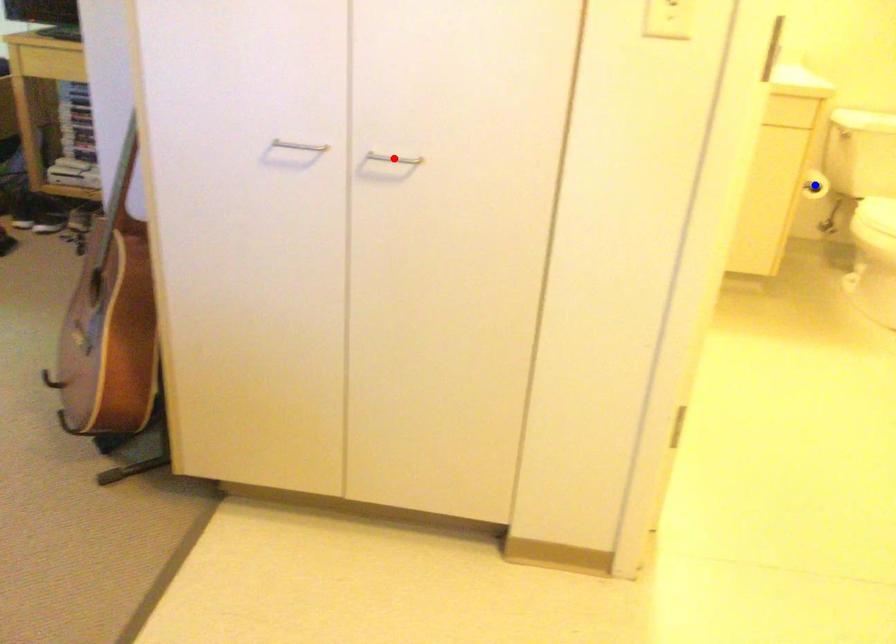
Question: Two points are marked on the image. Which point is closer to the camera?

Choices:
 (A) Blue point is closer.
 (B) Red point is closer.

Answer: (B)